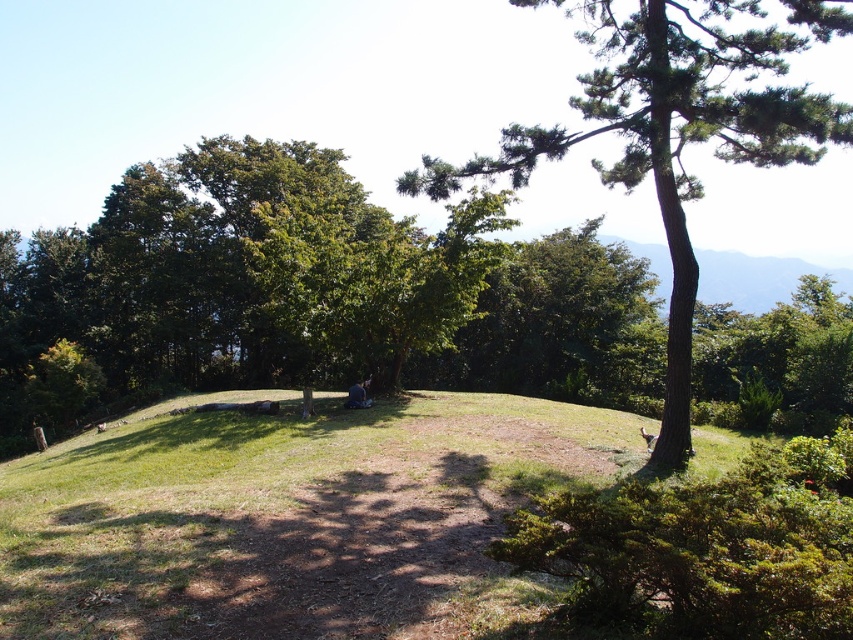
You are a hiker who wants to take a photo of the green textured tree at center and the blue denim jeans at center. Which object should you focus on first if you want both to be in sharp focus?

You should focus on the green textured tree at center first because it might be wider than the blue denim jeans at center, so using the tree as the focus point will ensure the jeans are also in focus.

You are standing in the middle of the scene and want to hide behind an object. Which object between the green textured tree at center and the blue denim jeans at center would be a better choice for hiding, and why?

The green textured tree at center is a better choice for hiding because it has a larger size compared to the blue denim jeans at center, providing more coverage.